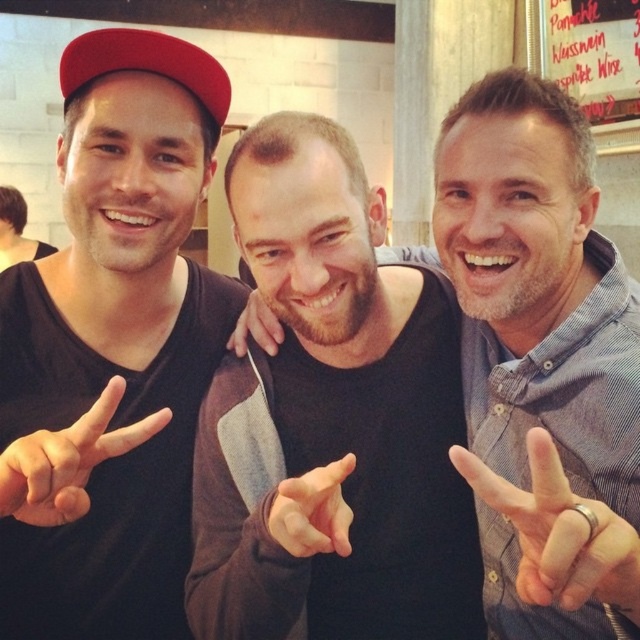
You are a photographer trying to focus on the silver metallic ring at right and the smooth skin hand at center. Which object is nearer to your camera lens?

The silver metallic ring at right is closer to the viewer than the smooth skin hand at center, so the ring will be in focus first.

You are a photographer trying to capture a closeup shot of the silver metallic ring at right and the smooth skin hand at center. Your camera can only focus on objects within a 20 cm range. Will both objects be in focus?

The silver metallic ring at right and smooth skin hand at center are 21.12 centimeters apart from each other. Since the camera can only focus within a 20 cm range, the distance between them exceeds the focus range, so they cannot both be in focus simultaneously.

You are trying to describe the scene to someone who can only see in black and white. Which object is positioned to the right of the other between the black matte shirt at center and the smooth skin hand at center?

The black matte shirt at center is positioned to the right of the smooth skin hand at center.